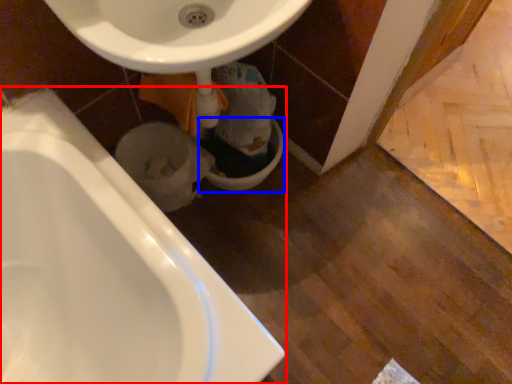
Question: Which point is further to the camera, bathtub (highlighted by a red box) or toilet bowl (highlighted by a blue box)?

Choices:
 (A) bathtub
 (B) toilet bowl

Answer: (B)